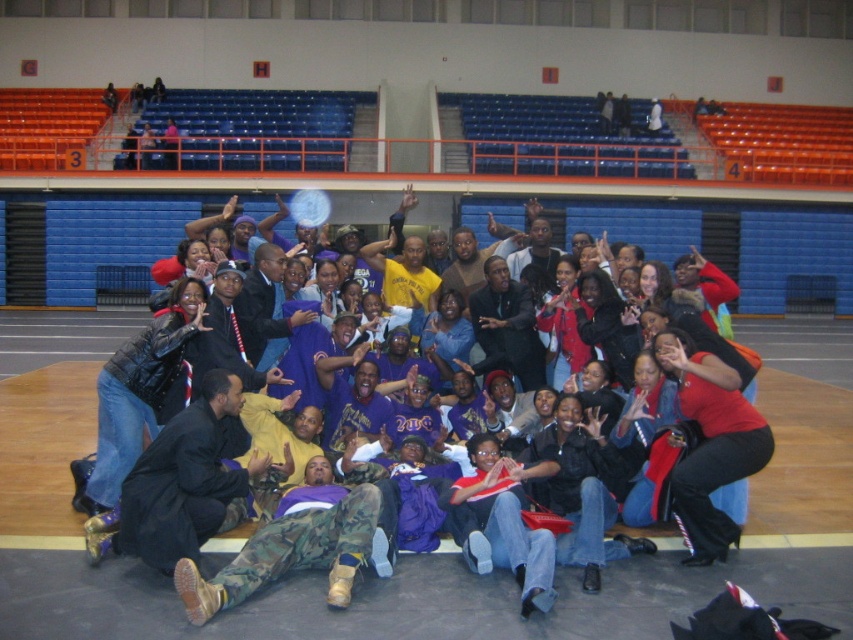
Question: Estimate the real-world distances between objects in this image. Which object is closer to the purple matte t-shirt at center?

Choices:
 (A) dark suit at center
 (B) black matte jacket at lower left
 (C) matte yellow t-shirt at center

Answer: (A)

Question: Which point appears farthest from the camera in this image?

Choices:
 (A) (409, 284)
 (B) (506, 326)

Answer: (A)

Question: Does purple matte t-shirt at center come in front of matte yellow t-shirt at center?

Choices:
 (A) no
 (B) yes

Answer: (B)

Question: Does purple matte t-shirt at center have a greater width compared to black matte jacket at lower left?

Choices:
 (A) no
 (B) yes

Answer: (B)

Question: Which point is farther to the camera?

Choices:
 (A) (715, 509)
 (B) (508, 324)
 (C) (178, 435)

Answer: (B)

Question: Can you confirm if purple matte t-shirt at center is positioned to the left of matte yellow t-shirt at center?

Choices:
 (A) yes
 (B) no

Answer: (B)